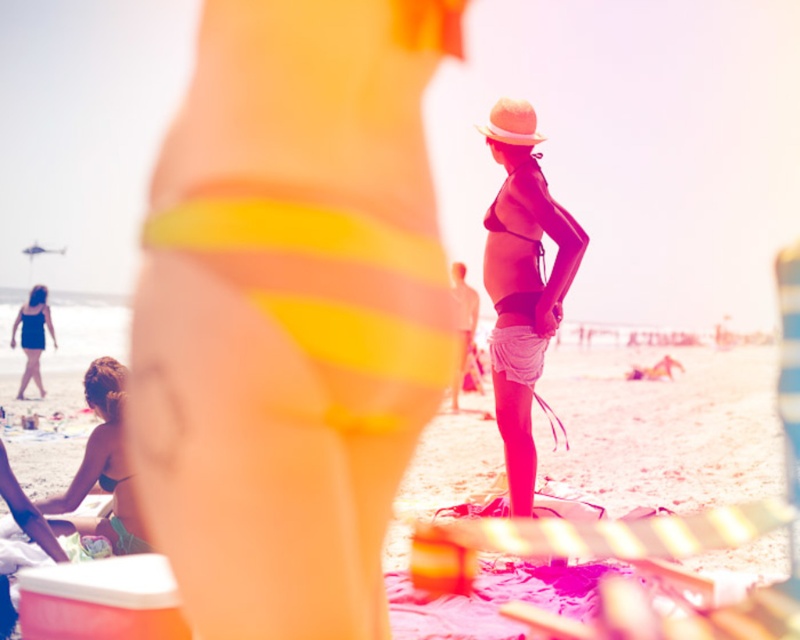
Is yellow fabric towel at center positioned at the back of matte yellow bikini bottom at lower left?

No.

What do you see at coordinates (662, 428) in the screenshot?
I see `yellow fabric towel at center` at bounding box center [662, 428].

Is point (424, 458) positioned behind point (120, 518)?

That is True.

Locate an element on the screen. The height and width of the screenshot is (640, 800). yellow fabric towel at center is located at coordinates (662, 428).

Does matte black swimsuit at lower left have a greater width compared to matte yellow bikini bottom at lower left?

Indeed, matte black swimsuit at lower left has a greater width compared to matte yellow bikini bottom at lower left.

Which is behind, point (42, 305) or point (124, 547)?

The point (42, 305) is behind.

Between point (34, 378) and point (136, 536), which one is positioned in front?

Point (136, 536)

Find the location of a particular element. This screenshot has height=640, width=800. matte black swimsuit at lower left is located at coordinates (32, 336).

Who is positioned more to the left, yellow striped bikini bottom at center or yellow fabric towel at center?

yellow striped bikini bottom at center is more to the left.

Does yellow striped bikini bottom at center have a larger size compared to yellow fabric towel at center?

Incorrect, yellow striped bikini bottom at center is not larger than yellow fabric towel at center.

The image size is (800, 640). I want to click on yellow striped bikini bottom at center, so click(290, 310).

Locate an element on the screen. yellow striped bikini bottom at center is located at coordinates (290, 310).